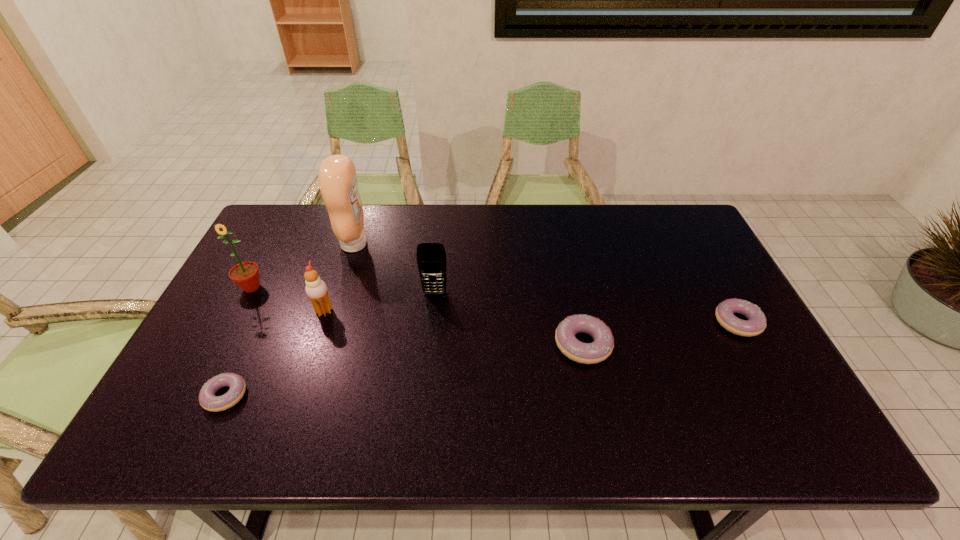
Point out which doughnut is positioned as the nearest to the third object from right to left. Please provide its 2D coordinates. Your answer should be formatted as a tuple, i.e. [(x, y)], where the tuple contains the x and y coordinates of a point satisfying the conditions above.

[(587, 353)]

The image size is (960, 540). In order to click on doughnut that is the closest one to the icecream in this screenshot , I will do `click(208, 400)`.

Find the location of `vacant point that satisfies the following two spatial constraints: 1. on the label of the condiment; 2. on the left side of the second shortest object`. vacant point that satisfies the following two spatial constraints: 1. on the label of the condiment; 2. on the left side of the second shortest object is located at coordinates (329, 322).

At what (x,y) coordinates should I click in order to perform the action: click on vacant space that satisfies the following two spatial constraints: 1. on the label of the second shortest object; 2. on the left side of the tallest object. Please return your answer as a coordinate pair (x, y). This screenshot has width=960, height=540. Looking at the image, I should click on click(329, 322).

Locate an element on the screen. This screenshot has height=540, width=960. free space that satisfies the following two spatial constraints: 1. on the label of the farthest object; 2. on the face of the second tallest object is located at coordinates [x=341, y=287].

Locate an element on the screen. free space that satisfies the following two spatial constraints: 1. at the front with a straw on the second object from right to left; 2. on the right side of the icecream is located at coordinates (313, 345).

Locate an element on the screen. free location that satisfies the following two spatial constraints: 1. on the screen of the cellular telephone; 2. at the front with a straw on the icecream is located at coordinates click(x=433, y=311).

Locate an element on the screen. free spot that satisfies the following two spatial constraints: 1. at the front with a straw on the icecream; 2. on the right side of the second tallest doughnut is located at coordinates (321, 322).

Image resolution: width=960 pixels, height=540 pixels. What are the coordinates of `free space that satisfies the following two spatial constraints: 1. on the screen of the second shortest doughnut; 2. on the left side of the cellular telephone` in the screenshot? It's located at (432, 322).